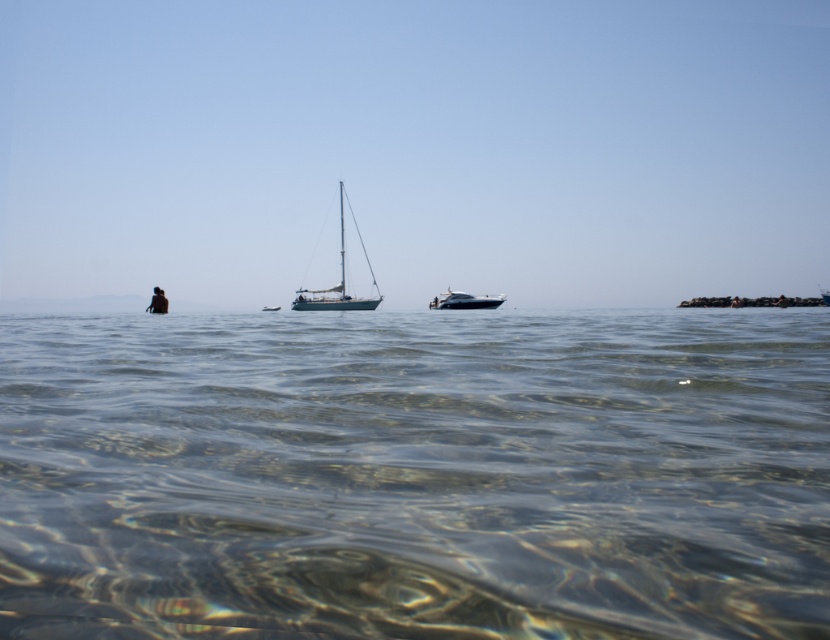
In the scene shown: Is clear water at center bigger than shiny silver yacht at center?

Yes.

Who is taller, clear water at center or shiny silver yacht at center?

With more height is shiny silver yacht at center.

Between point (178, 422) and point (492, 298), which one is positioned behind?

Positioned behind is point (492, 298).

Where is `clear water at center`? The width and height of the screenshot is (830, 640). clear water at center is located at coordinates (415, 474).

The image size is (830, 640). Describe the element at coordinates (335, 285) in the screenshot. I see `white glossy sailboat at center` at that location.

I want to click on white glossy sailboat at center, so click(335, 285).

Between clear water at center and white glossy sailboat at center, which one has more height?

With more height is white glossy sailboat at center.

Does point (166, 618) come farther from viewer compared to point (328, 308)?

No, it is not.

Does point (217, 524) come in front of point (342, 241)?

Yes, point (217, 524) is closer to viewer.

You are a GUI agent. You are given a task and a screenshot of the screen. Output one action in this format:
    pyautogui.click(x=<x>, y=<y>)
    Task: Click on the clear water at center
    The image size is (830, 640).
    Given the screenshot: What is the action you would take?
    pyautogui.click(x=415, y=474)